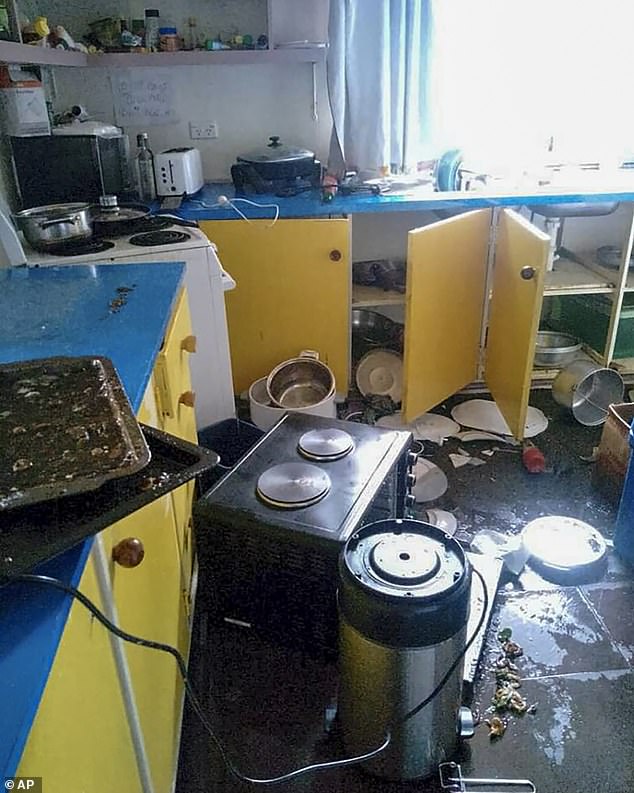
What are the coordinates of `faucet` in the screenshot? It's located at (552, 148).